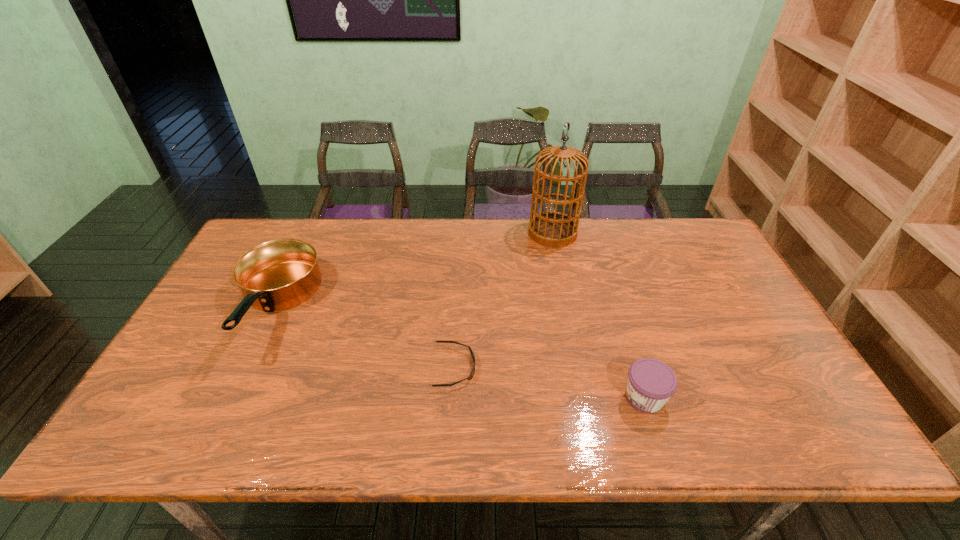
This screenshot has height=540, width=960. I want to click on vacant space located 0.350m on the front label of the third tallest object, so click(x=473, y=397).

At what (x,y) coordinates should I click in order to perform the action: click on vacant space located on the front label of the third tallest object. Please return your answer as a coordinate pair (x, y). Image resolution: width=960 pixels, height=540 pixels. Looking at the image, I should click on (503, 397).

Locate an element on the screen. The image size is (960, 540). vacant space located on the front-facing side of the second object from left to right is located at coordinates (540, 367).

Find the location of `birdcage present at the far edge`. birdcage present at the far edge is located at coordinates (552, 229).

The width and height of the screenshot is (960, 540). I want to click on frying pan positioned at the far edge, so click(x=280, y=274).

Image resolution: width=960 pixels, height=540 pixels. I want to click on object that is at the near edge, so click(x=651, y=383).

Locate an element on the screen. The image size is (960, 540). object at the left edge is located at coordinates (280, 274).

This screenshot has width=960, height=540. What are the coordinates of `object situated at the far left corner` in the screenshot? It's located at (280, 274).

Locate an element on the screen. free space at the far edge of the desktop is located at coordinates (644, 233).

Where is `free space at the left edge of the desktop`? This screenshot has width=960, height=540. free space at the left edge of the desktop is located at coordinates (174, 366).